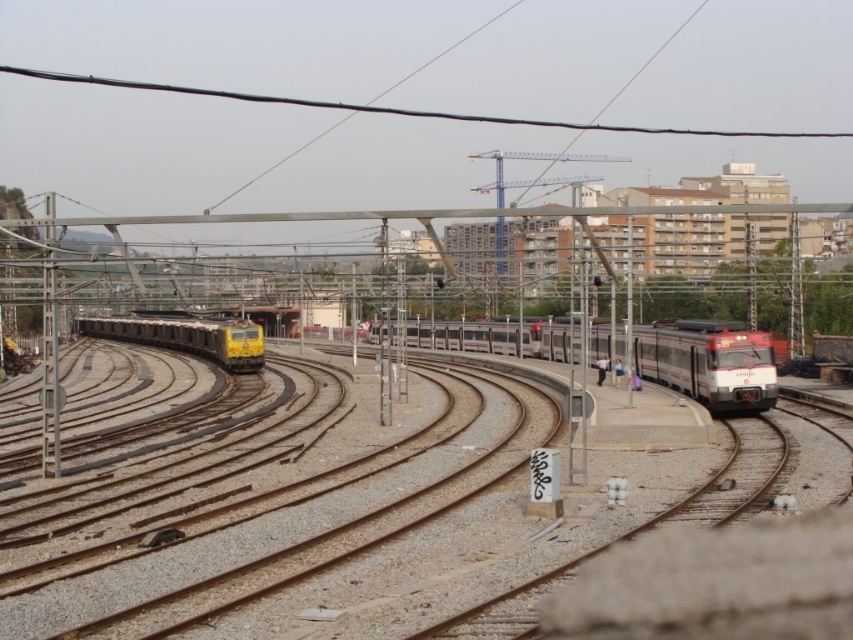
Question: Can you confirm if smooth wire at upper center is positioned below yellow metallic train at center?

Choices:
 (A) yes
 (B) no

Answer: (B)

Question: Which of these objects is positioned closest to the smooth wire at upper center?

Choices:
 (A) yellow metallic train at left
 (B) red glossy train at center

Answer: (B)

Question: Which is nearer to the smooth wire at upper center?

Choices:
 (A) red glossy train at center
 (B) yellow metallic train at left
 (C) yellow metallic train at center

Answer: (C)

Question: Does smooth wire at upper center have a larger size compared to yellow metallic train at center?

Choices:
 (A) yes
 (B) no

Answer: (A)

Question: Which point is closer to the camera taking this photo?

Choices:
 (A) (122, 80)
 (B) (256, 340)

Answer: (B)

Question: Does yellow metallic train at left come in front of smooth wire at upper center?

Choices:
 (A) yes
 (B) no

Answer: (A)